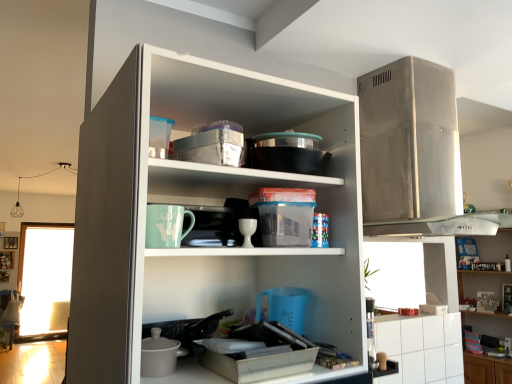
Where is `free space above white matte cupboard at center (from a real-world perspective)`? This screenshot has height=384, width=512. free space above white matte cupboard at center (from a real-world perspective) is located at coordinates (223, 99).